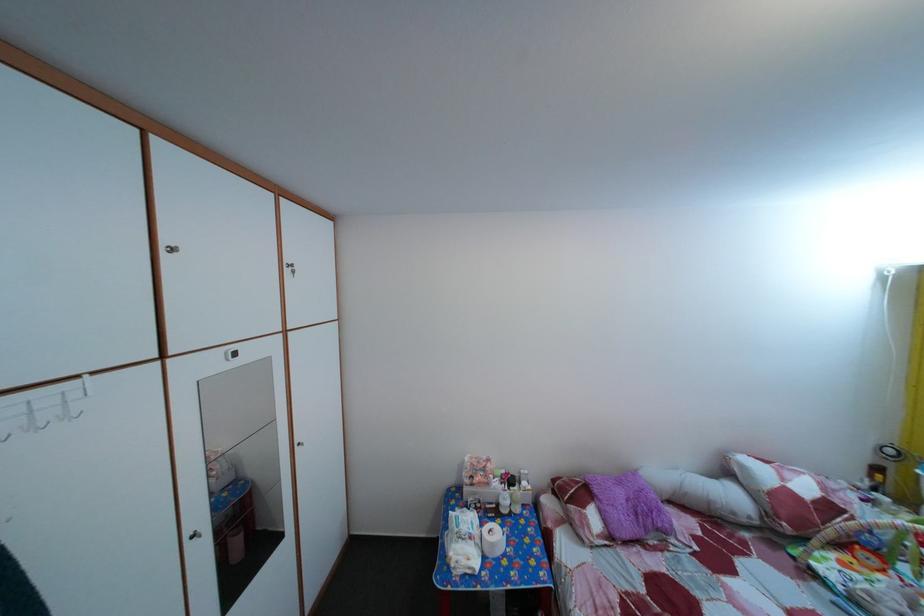
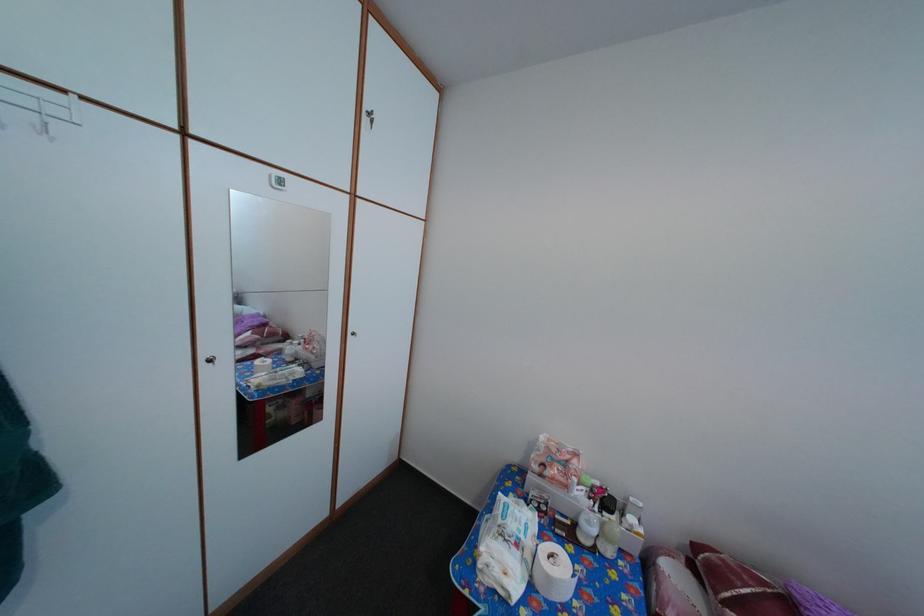
Locate, in the second image, the point that corresponds to (x=512, y=509) in the first image.

(592, 531)